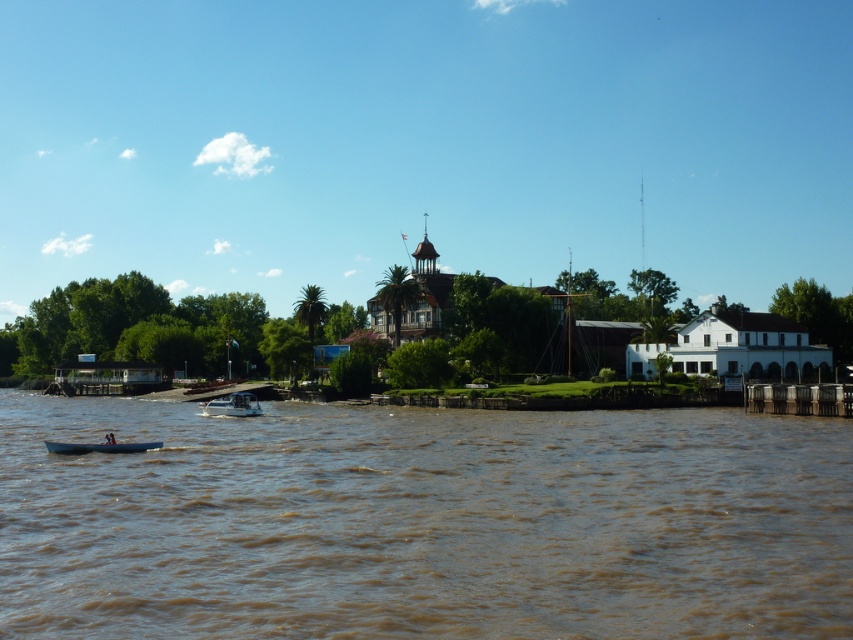
You are a photographer trying to capture the two points in the image. Which point, point (354,502) or point (252,403), will appear larger in your photo?

Point (354,502) will appear larger in the photo because it is closer to the camera than point (252,403).

You are standing at the point marked as point (422, 522) in the image. What is the terrain like at your current location?

The terrain at point (422, 522) is brown muddy water at lower center, which is part of the muddy brown water in the foreground of the scene.